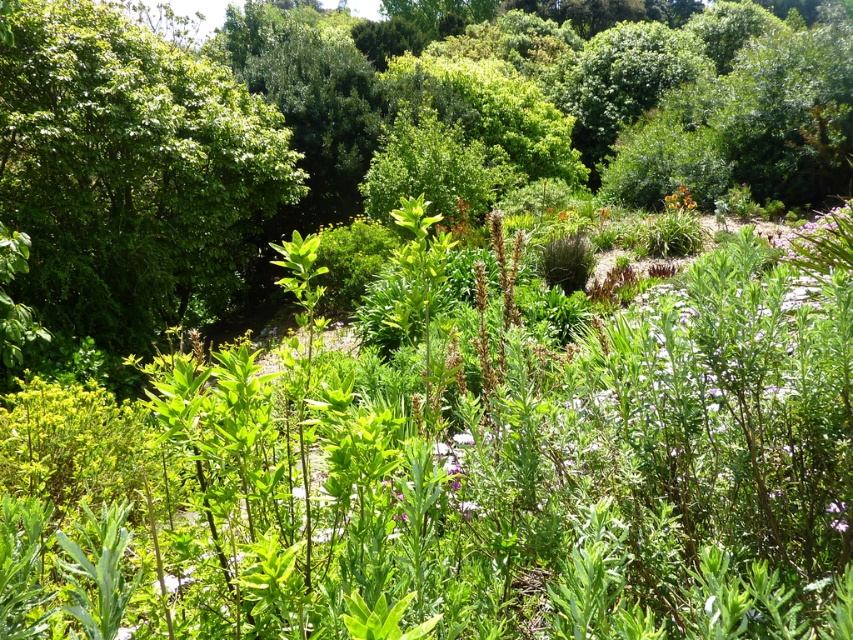
Question: Which point is closer to the camera taking this photo?

Choices:
 (A) (83, 134)
 (B) (120, 176)
 (C) (820, 220)

Answer: (A)

Question: Which point is farther to the camera?

Choices:
 (A) (119, 208)
 (B) (138, 321)
 (C) (843, 268)
 (D) (679, 200)

Answer: (D)

Question: Is purple matte flower at upper right below orange matte flower at upper right?

Choices:
 (A) yes
 (B) no

Answer: (A)

Question: Does purple matte flower at upper right have a smaller size compared to orange matte flower at upper right?

Choices:
 (A) no
 (B) yes

Answer: (A)

Question: From the image, what is the correct spatial relationship of green leafy tree at center in relation to green leafy tree at upper left?

Choices:
 (A) below
 (B) above

Answer: (B)

Question: Among these points, which one is farthest from the camera?

Choices:
 (A) (808, 257)
 (B) (170, 236)
 (C) (102, 12)
 (D) (679, 196)

Answer: (D)